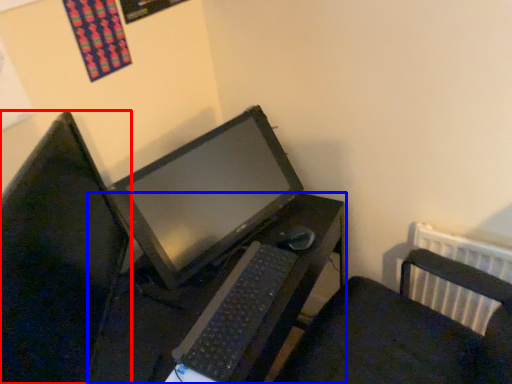
Question: Which object appears closest to the camera in this image, computer monitor (highlighted by a red box) or desk (highlighted by a blue box)?

Choices:
 (A) computer monitor
 (B) desk

Answer: (A)